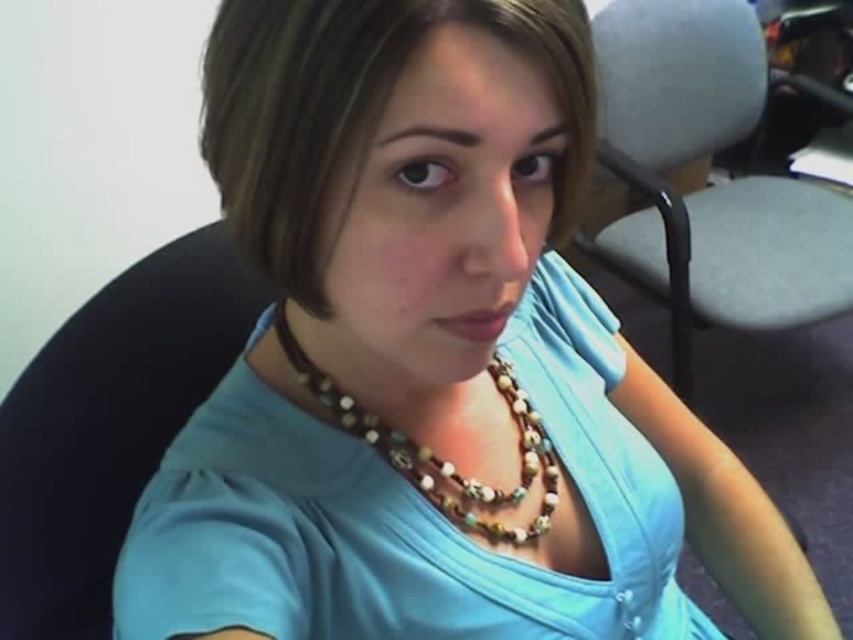
Question: Is gray fabric swivel chair at right smaller than brown beaded necklace at center?

Choices:
 (A) yes
 (B) no

Answer: (B)

Question: Which object is closer to the camera taking this photo?

Choices:
 (A) brown beaded necklace at center
 (B) gray fabric swivel chair at right

Answer: (A)

Question: Can you confirm if gray fabric swivel chair at right is thinner than brown beaded necklace at center?

Choices:
 (A) yes
 (B) no

Answer: (B)

Question: Can you confirm if gray fabric swivel chair at right is bigger than brown beaded necklace at center?

Choices:
 (A) yes
 (B) no

Answer: (A)

Question: Which point appears closest to the camera in this image?

Choices:
 (A) (635, 180)
 (B) (305, 365)

Answer: (B)